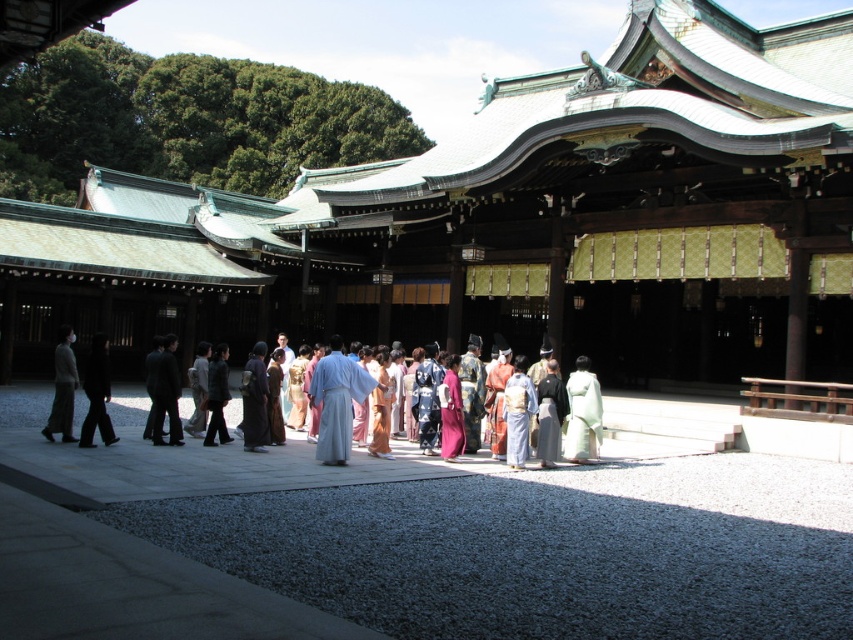
You are standing at the entrance of the shrine and want to walk to the point marked as point (322, 456). However, there is an obstacle at point (567, 392). Will you encounter the obstacle before reaching your destination?

Since point (322, 456) is closer to the camera than point (567, 392), you will reach your destination before encountering the obstacle at point (567, 392).

You are a visitor at the shrine and want to walk from the entrance to the main building. There are two people wearing traditional clothing in your path. One is wearing a light blue silk robe at center and the other a white silk kimono at center. How far apart are these two individuals standing?

The light blue silk robe at center and the white silk kimono at center are 36.93 feet apart.